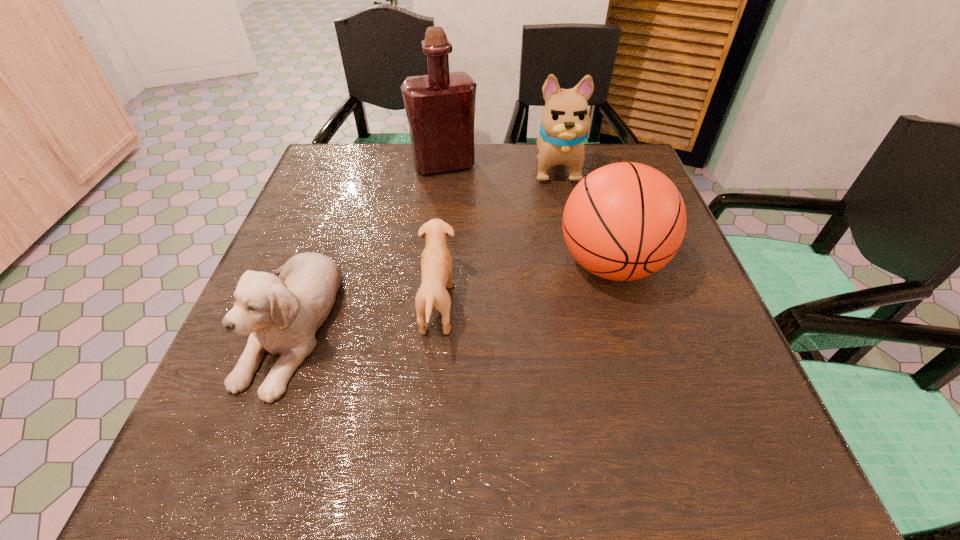
Identify the location of the tallest object. (440, 107).

Locate an element on the screen. The image size is (960, 540). the rightmost puppy is located at coordinates (565, 118).

Find the location of `the tallest puppy`. the tallest puppy is located at coordinates (565, 118).

At what (x,y) coordinates should I click in order to perform the action: click on basketball. Please return your answer as a coordinate pair (x, y). Looking at the image, I should click on point(624,221).

Where is `the fourth tallest object`? the fourth tallest object is located at coordinates [282, 314].

Image resolution: width=960 pixels, height=540 pixels. Find the location of `the leftmost object`. the leftmost object is located at coordinates (282, 314).

You are a GUI agent. You are given a task and a screenshot of the screen. Output one action in this format:
    pyautogui.click(x=<x>, y=<y>)
    Task: Click on the shortest object
    The width and height of the screenshot is (960, 540).
    Given the screenshot: What is the action you would take?
    pyautogui.click(x=436, y=262)

This screenshot has width=960, height=540. Identify the location of the shortest puppy. (436, 262).

The width and height of the screenshot is (960, 540). In order to click on blank space located on the left of the liquor in this screenshot , I will do `click(355, 165)`.

This screenshot has width=960, height=540. I want to click on vacant space located on the face of the rightmost puppy, so [x=569, y=228].